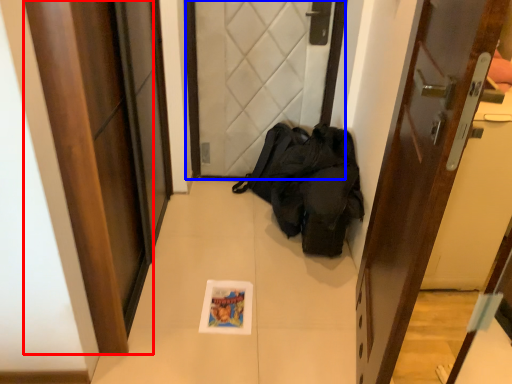
Question: Among these objects, which one is farthest to the camera, door (highlighted by a red box) or door (highlighted by a blue box)?

Choices:
 (A) door
 (B) door

Answer: (B)